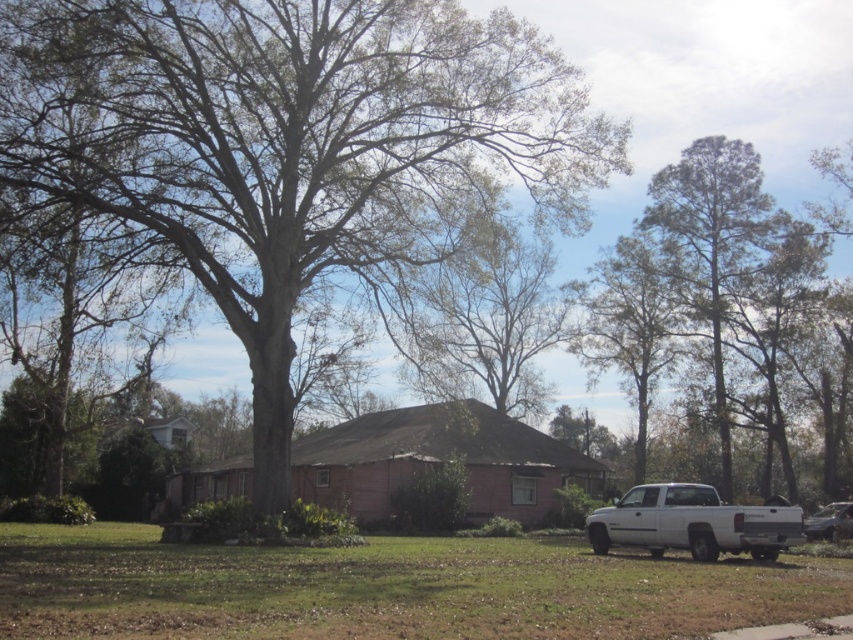
Question: Is bare wood tree at center thinner than metallic silver sedan at lower right?

Choices:
 (A) no
 (B) yes

Answer: (A)

Question: Which is farther from the bare wood tree at center?

Choices:
 (A) green grass at lower right
 (B) white matte truck at lower right

Answer: (B)

Question: Among these points, which one is farthest from the camera?

Choices:
 (A) (432, 204)
 (B) (434, 625)
 (C) (769, 516)
 (D) (816, 528)

Answer: (A)

Question: Considering the relative positions of white matte truck at lower right and metallic silver sedan at lower right in the image provided, where is white matte truck at lower right located with respect to metallic silver sedan at lower right?

Choices:
 (A) below
 (B) above

Answer: (A)

Question: Is bare wood tree at center positioned before white matte truck at lower right?

Choices:
 (A) yes
 (B) no

Answer: (B)

Question: Based on their relative distances, which object is farther from the bare wood tree at center?

Choices:
 (A) green grass at lower right
 (B) white matte truck at lower right

Answer: (B)